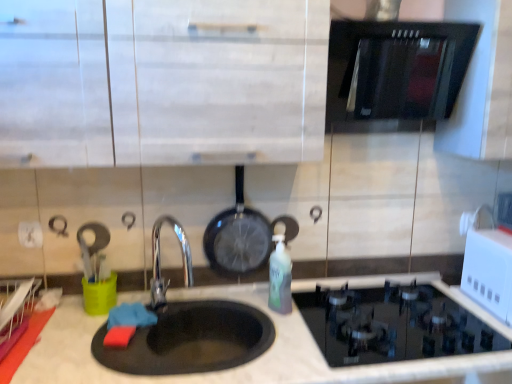
I want to click on unoccupied space behind translucent green bottle at center, so [x=265, y=297].